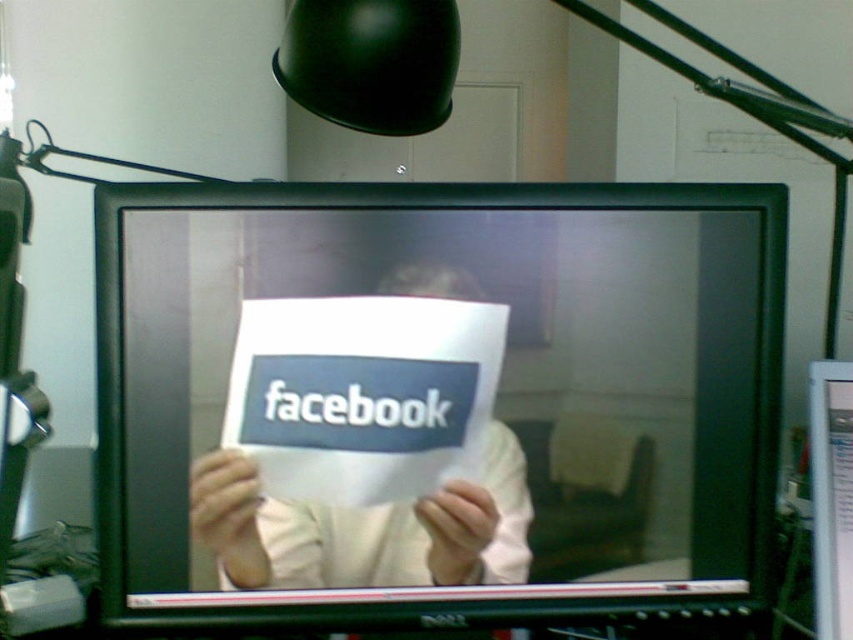
You are trying to position a sticker on the monitor. The sticker is 10 inches wide. The point at (741, 378) is where you want to place it. Can you fit the sticker horizontally without overlapping the edges?

The distance between the point at (741, 378) and the edge of the monitor is 31.69 inches. Since the sticker is only 10 inches wide, it will fit horizontally without overlapping the edges.

You are trying to locate the black glossy monitor at center in the image. What are its coordinates?

The black glossy monitor at center is located at coordinates (434, 401).

You are trying to place a 75 centimeter wide poster between the black glossy monitor at center and another object. Is there enough space?

The distance between the black glossy monitor at center and the other object is 75.41 centimeters, which is just enough to fit a 75 centimeter wide poster between them.